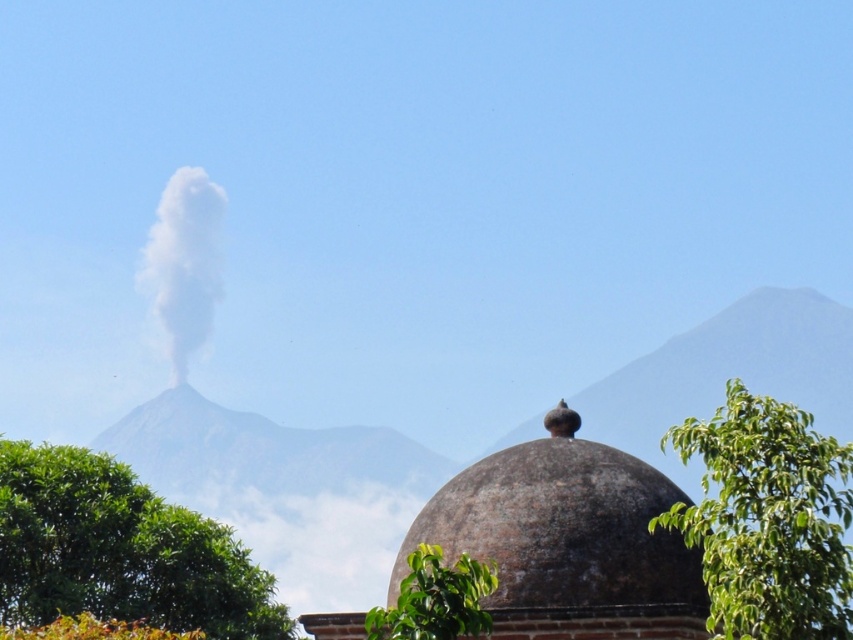
You are standing in the landscape scene and want to reach both points, point (109, 572) and point (218, 225). Which point should you head towards first if you want to reach the one closer to you first?

You should head towards point (109, 572) first because it is closer to you than point (218, 225).

You are standing at the center of the scene and notice the green leafy tree at center. Based on its position, can you determine if it is closer to the foreground or the background?

The green leafy tree at center is located at point (120, 552), which places it closer to the foreground since lower y coordinates typically indicate closer proximity in such coordinate systems.

You are an architect assessing the landscape for a new project. You observe the rustic stone dome at center and the green leafy tree at lower center. Which structure has a taller height?

The rustic stone dome at center has a greater height compared to the green leafy tree at lower center.